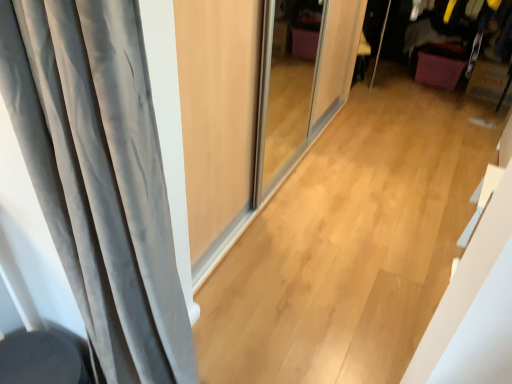
Where is `free space in front of satin gray curtain at left`? This screenshot has width=512, height=384. free space in front of satin gray curtain at left is located at coordinates click(x=316, y=274).